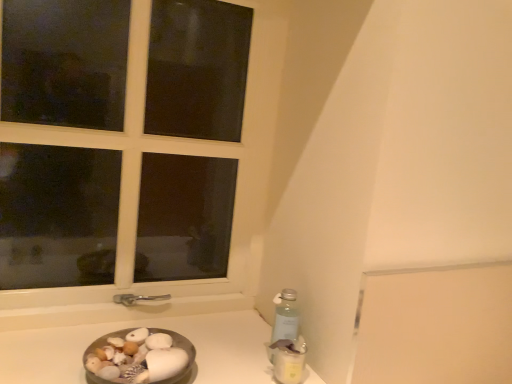
Question: Based on their positions, is smooth white shells at lower left located to the left or right of white plastic window at upper left?

Choices:
 (A) left
 (B) right

Answer: (B)

Question: From a real-world perspective, is smooth white shells at lower left above or below white plastic window at upper left?

Choices:
 (A) above
 (B) below

Answer: (B)

Question: Considering the real-world distances, which object is closest to the smooth white shells at lower left?

Choices:
 (A) white plastic window at upper left
 (B) translucent plastic bottle at lower right
 (C) metallic silver bowl at lower left

Answer: (C)

Question: Based on their relative distances, which object is farther from the metallic silver bowl at lower left?

Choices:
 (A) white plastic window at upper left
 (B) smooth white shells at lower left
 (C) translucent plastic bottle at lower right

Answer: (A)